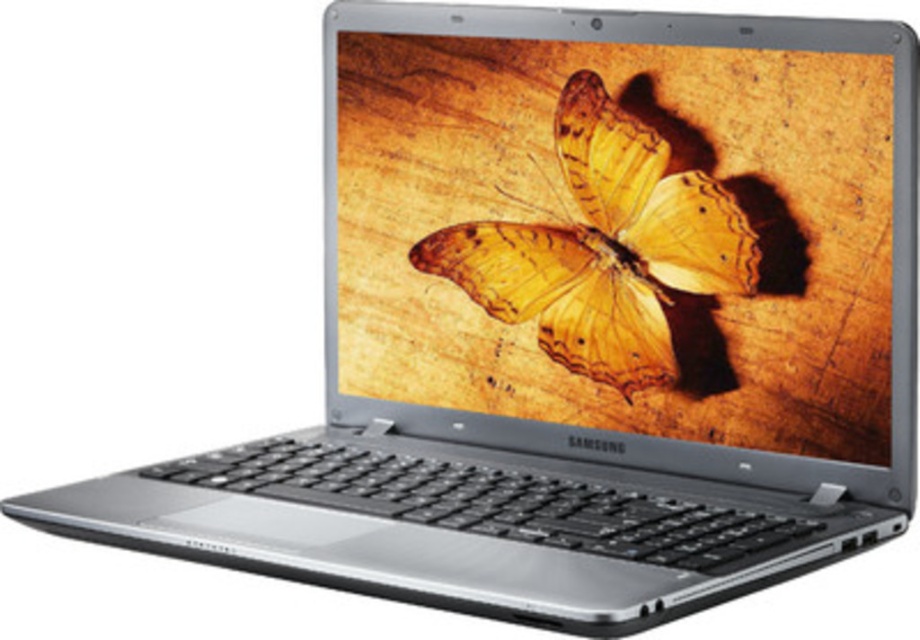
Does metallic silver laptop at center lie behind yellow translucent wings at center?

No, it is in front of yellow translucent wings at center.

Does metallic silver laptop at center have a lesser width compared to yellow translucent wings at center?

Incorrect, metallic silver laptop at center's width is not less than yellow translucent wings at center's.

I want to click on metallic silver laptop at center, so click(619, 236).